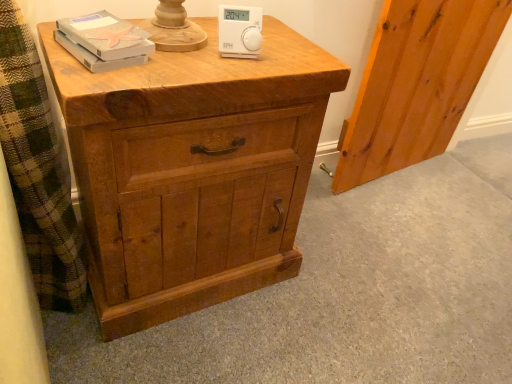
You are a GUI agent. You are given a task and a screenshot of the screen. Output one action in this format:
    pyautogui.click(x=<x>, y=<y>)
    Task: Click on the unoccupied region to the right of matte gray book at upper left
    The height and width of the screenshot is (384, 512).
    Given the screenshot: What is the action you would take?
    pyautogui.click(x=183, y=46)